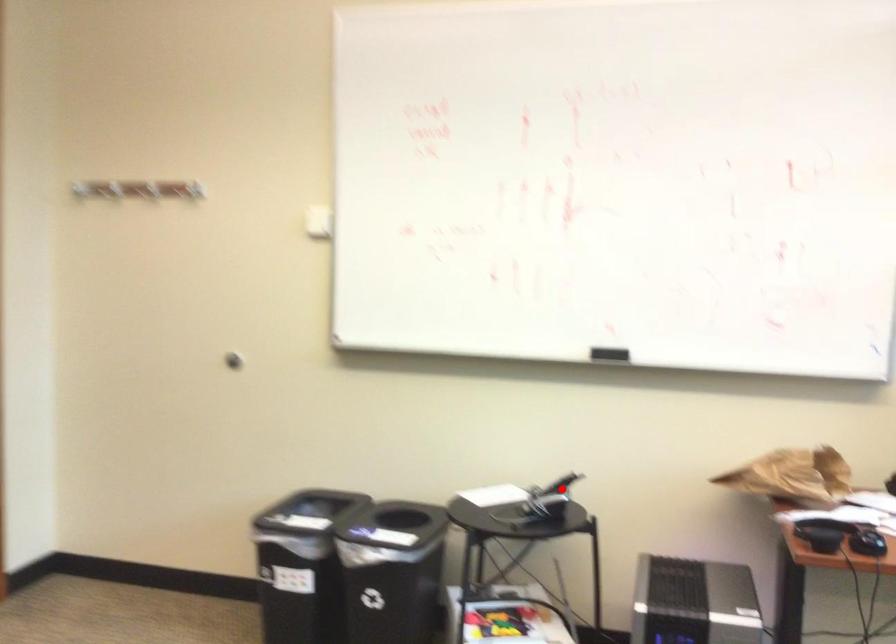
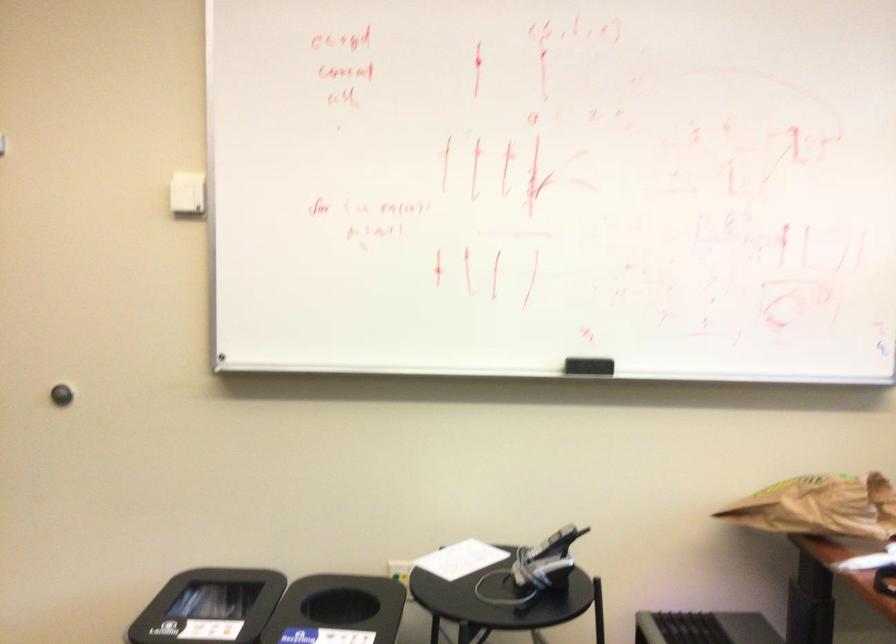
Question: I am providing you with two images of the same scene from different viewpoints. Given a red point in image1, look at the same physical point in image2. Is it:

Choices:
 (A) Closer to the viewpoint
 (B) Farther from the viewpoint

Answer: (A)